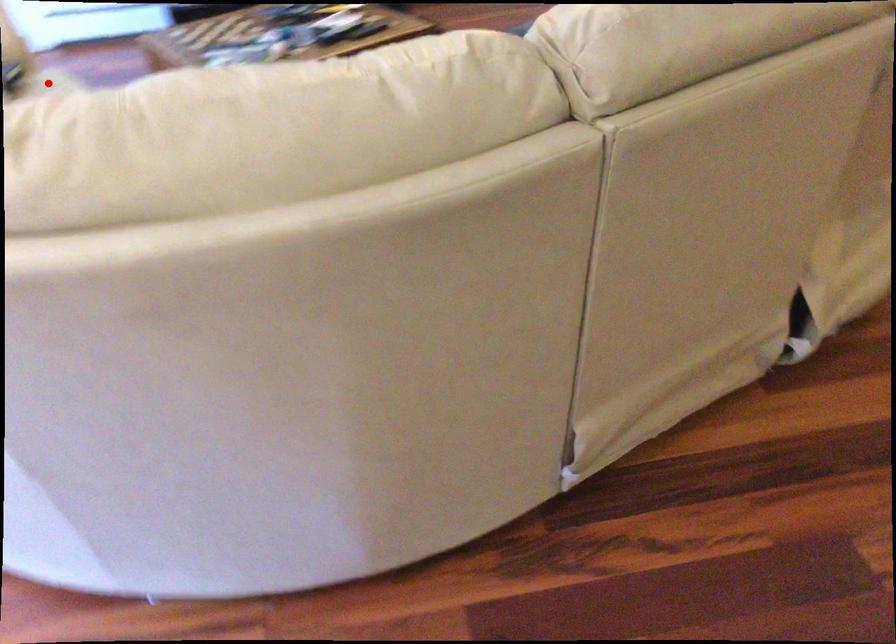
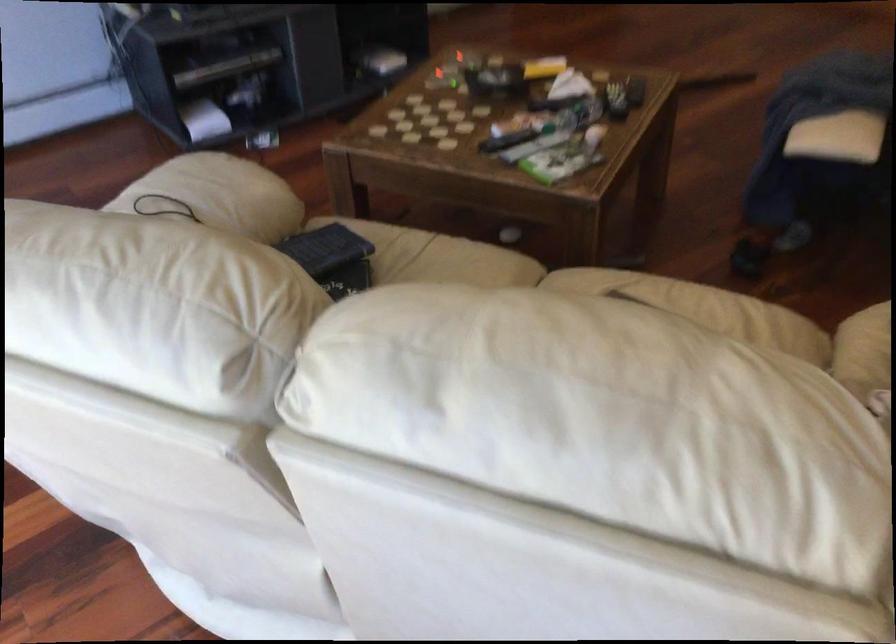
Question: I am providing you with two images of the same scene from different viewpoints. A red point is marked on the first image. Can you still see the location of the red point in image 2?

Choices:
 (A) Yes
 (B) No

Answer: (B)